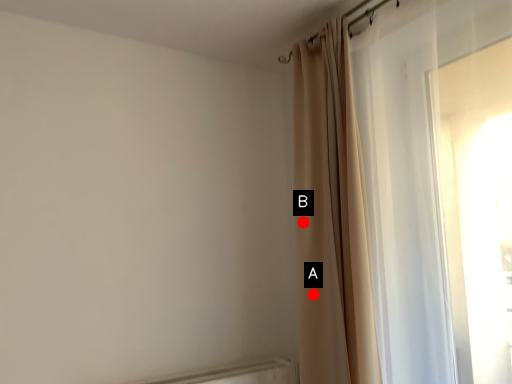
Question: Two points are circled on the image, labeled by A and B beside each circle. Which point is closer to the camera taking this photo?

Choices:
 (A) A is closer
 (B) B is closer

Answer: (A)